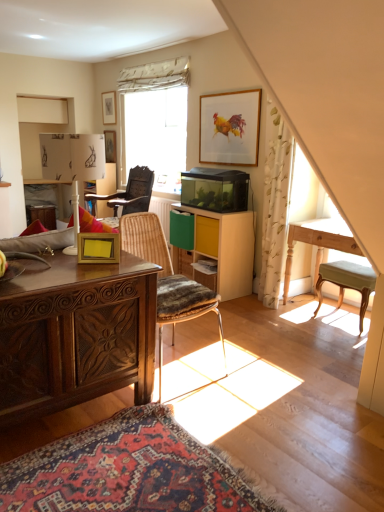
You are a GUI agent. You are given a task and a screenshot of the screen. Output one action in this format:
    pyautogui.click(x=<x>, y=<y>)
    Task: Click on the free space between green fabric stool at right, the 2th chair from the back, and rustic wood chair at center, marked as the 1th chair in a front-to-back arrangement
    The width and height of the screenshot is (384, 512).
    Given the screenshot: What is the action you would take?
    pyautogui.click(x=285, y=342)